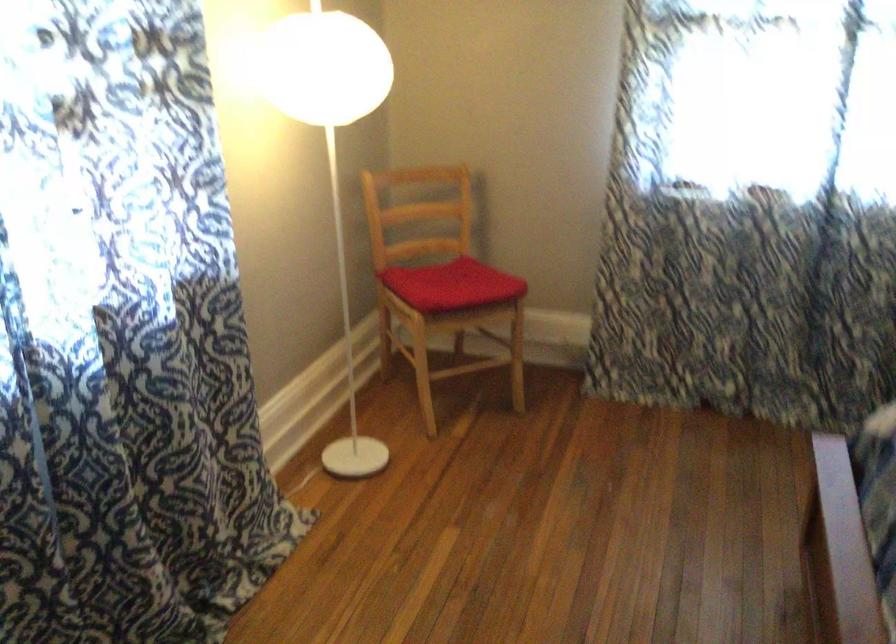
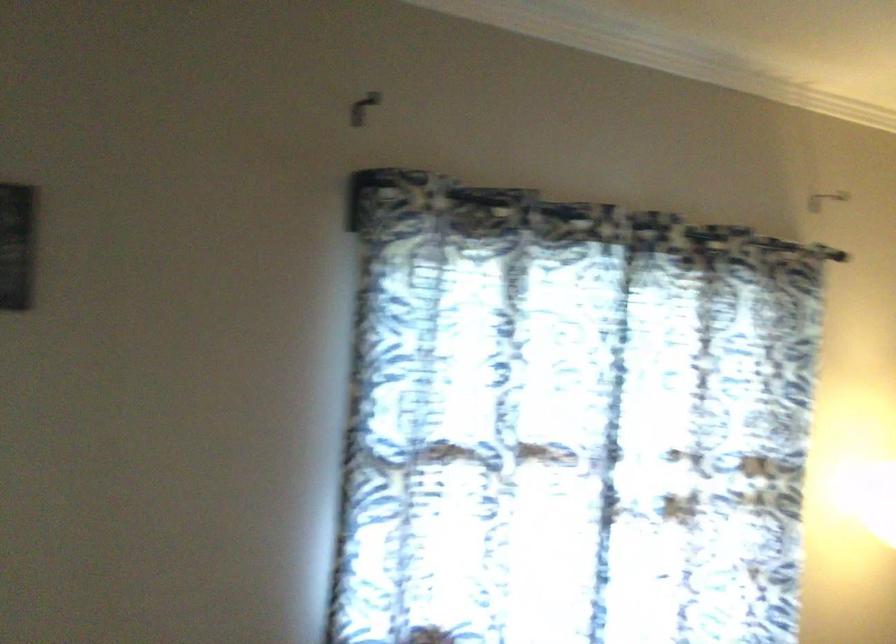
Question: How did the camera likely rotate?

Choices:
 (A) Left
 (B) Right
 (C) Up
 (D) Down

Answer: (A)